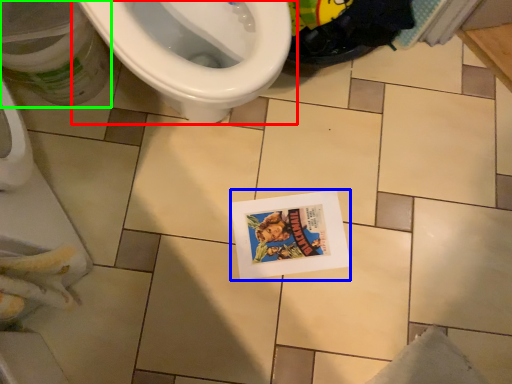
Question: Based on their relative distances, which object is nearer to toilet (highlighted by a red box)? Choose from comic book (highlighted by a blue box) and potty (highlighted by a green box).

Choices:
 (A) comic book
 (B) potty

Answer: (B)